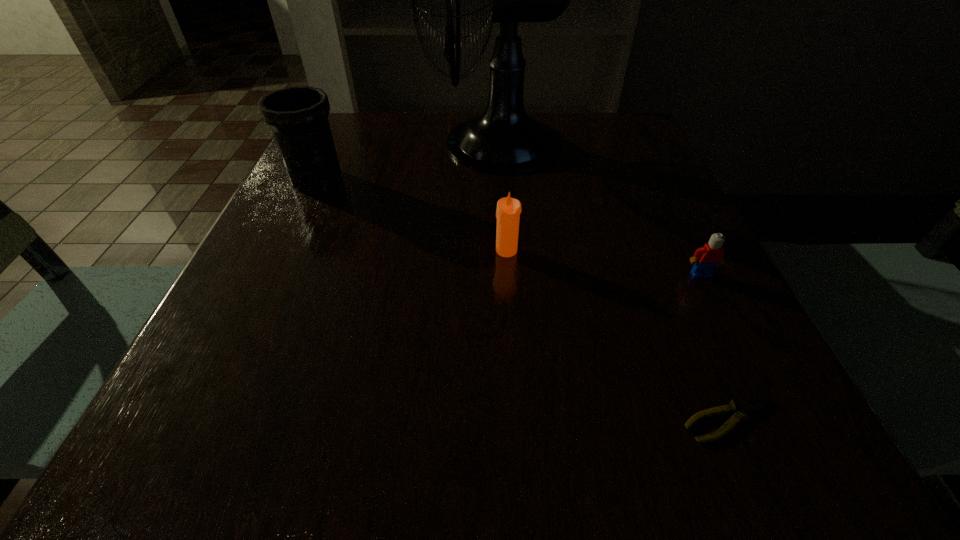
This screenshot has width=960, height=540. Find the location of `the tallest object`. the tallest object is located at coordinates (504, 139).

Identify the location of the second tallest object. This screenshot has height=540, width=960. (298, 116).

This screenshot has width=960, height=540. Identify the location of the leftmost object. (298, 116).

Where is `the third shortest object`? the third shortest object is located at coordinates (508, 211).

I want to click on candle, so [508, 211].

Where is `the fourth farthest object`? The height and width of the screenshot is (540, 960). the fourth farthest object is located at coordinates point(706,258).

Where is `the fourth tallest object`? the fourth tallest object is located at coordinates point(706,258).

Identify the location of pliers. The height and width of the screenshot is (540, 960). (745, 406).

This screenshot has height=540, width=960. I want to click on the shortest object, so click(745, 406).

Where is `vacant area situated on the front-facing side of the fan`? vacant area situated on the front-facing side of the fan is located at coordinates (400, 144).